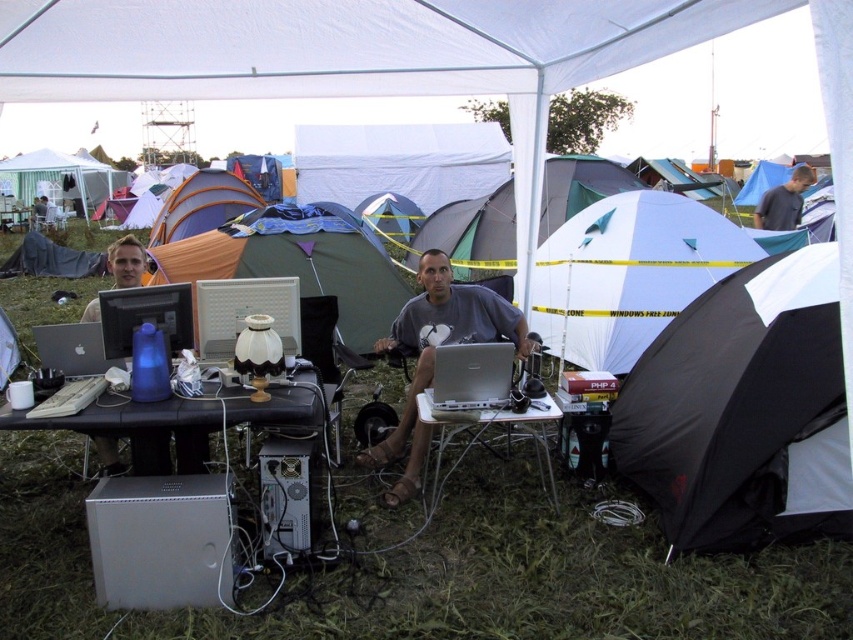
Question: Is white plastic table at center behind gray fabric shirt at center?

Choices:
 (A) yes
 (B) no

Answer: (B)

Question: Can you confirm if black fabric tent at lower right is positioned above green canvas tent at center?

Choices:
 (A) yes
 (B) no

Answer: (B)

Question: Does white fabric tent at center appear over gray fabric shirt at center?

Choices:
 (A) no
 (B) yes

Answer: (A)

Question: Considering the real-world distances, which object is closest to the gray fabric shirt at center?

Choices:
 (A) black fabric tent at lower right
 (B) silver metallic laptop at center
 (C) white fabric tent at center
 (D) green canvas tent at center

Answer: (C)

Question: Which object is the closest to the matte black laptop at center?

Choices:
 (A) gray matte shirt at center
 (B) gray fabric shirt at center

Answer: (A)

Question: Which point is farther to the camera?

Choices:
 (A) white fabric tent at center
 (B) white plastic table at center
 (C) black fabric tent at lower right
 (D) matte black monitor at center

Answer: (A)